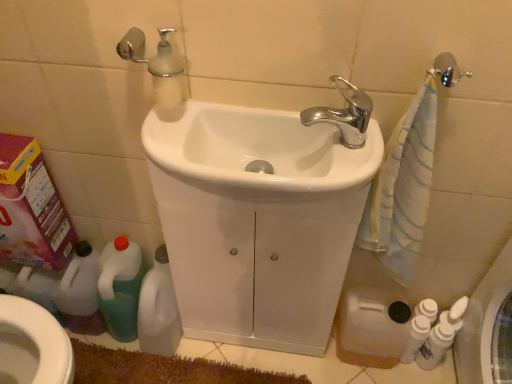
This screenshot has height=384, width=512. Find the location of `vacant region in front of green plastic bottle at lower left, the 4th cleaning product positioned from the right`. vacant region in front of green plastic bottle at lower left, the 4th cleaning product positioned from the right is located at coordinates (125, 363).